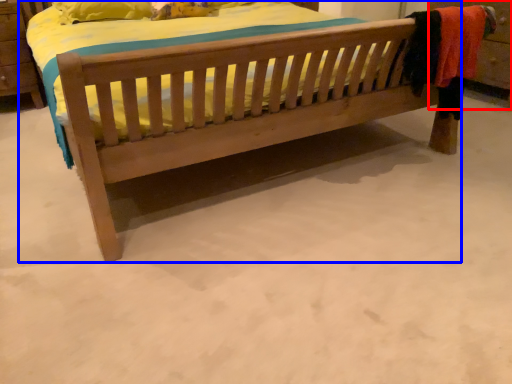
Question: Which object appears farthest to the camera in this image, dresser (highlighted by a red box) or bed (highlighted by a blue box)?

Choices:
 (A) dresser
 (B) bed

Answer: (A)